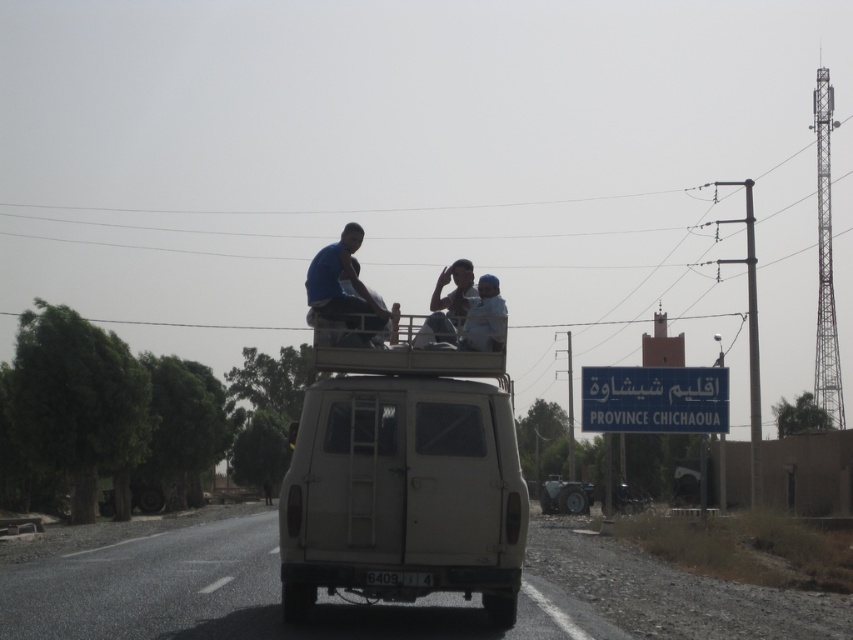
Does metallic rectangular sign at center appear on the left side of light blue fabric at center?

No, metallic rectangular sign at center is not to the left of light blue fabric at center.

Identify the location of metallic rectangular sign at center. This screenshot has width=853, height=640. (654, 400).

Who is more forward, (616, 424) or (503, 316)?

Point (503, 316) is in front.

I want to click on metallic rectangular sign at center, so click(x=654, y=400).

Where is `blue fabric shirt at center`? This screenshot has height=640, width=853. blue fabric shirt at center is located at coordinates (341, 289).

Which is more to the right, blue fabric shirt at center or light blue fabric at center?

From the viewer's perspective, light blue fabric at center appears more on the right side.

The image size is (853, 640). I want to click on blue fabric shirt at center, so click(x=341, y=289).

Between point (608, 388) and point (355, 276), which one is positioned behind?

The point (608, 388) is behind.

Between metallic rectangular sign at center and blue fabric shirt at center, which one has less height?

blue fabric shirt at center

Is point (663, 380) closer to camera compared to point (340, 310)?

No.

You are a GUI agent. You are given a task and a screenshot of the screen. Output one action in this format:
    pyautogui.click(x=<x>, y=<y>)
    Task: Click on the metallic rectangular sign at center
    The image size is (853, 640).
    Given the screenshot: What is the action you would take?
    [x=654, y=400]